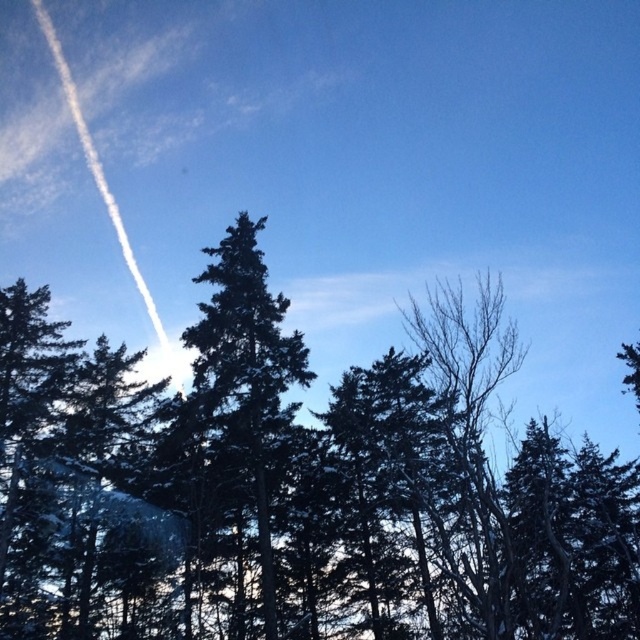
Who is taller, green needle-like trees at center or green needle-like tree at center?

Standing taller between the two is green needle-like trees at center.

Describe the element at coordinates (296, 484) in the screenshot. I see `green needle-like trees at center` at that location.

Where is `green needle-like trees at center`? The height and width of the screenshot is (640, 640). green needle-like trees at center is located at coordinates pos(296,484).